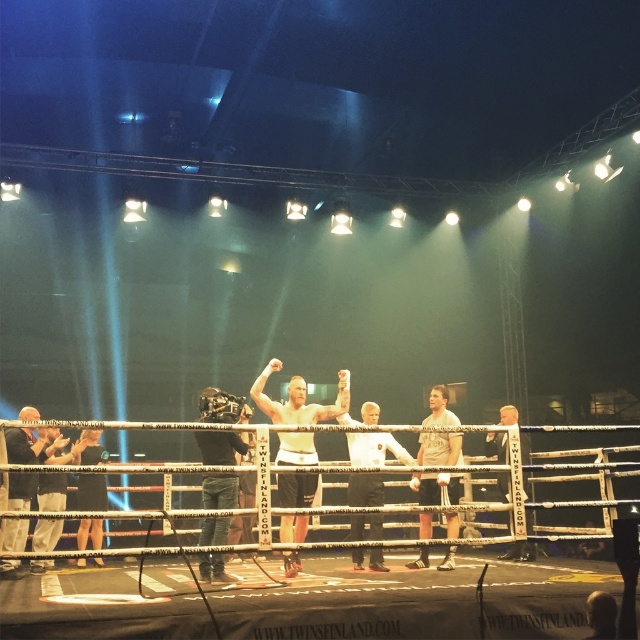
Which is behind, point (224, 566) or point (13, 499)?

Positioned behind is point (13, 499).

Which is more to the right, denim jeans at center or dark gray fabric jacket at left?

Positioned to the right is denim jeans at center.

The height and width of the screenshot is (640, 640). In order to click on denim jeans at center in this screenshot , I will do `click(220, 445)`.

You are a GUI agent. You are given a task and a screenshot of the screen. Output one action in this format:
    pyautogui.click(x=<x>, y=<y>)
    Task: Click on the denim jeans at center
    This screenshot has height=640, width=640.
    Given the screenshot: What is the action you would take?
    pyautogui.click(x=220, y=445)

Does denim jeans at center have a greater width compared to light gray cotton shirt at center?

No, denim jeans at center is not wider than light gray cotton shirt at center.

Measure the distance between denim jeans at center and camera.

They are 5.09 meters apart.

Where is `denim jeans at center`? The image size is (640, 640). denim jeans at center is located at coordinates (220, 445).

Which is in front, point (289, 380) or point (200, 433)?

Positioned in front is point (200, 433).

Is matte white shirt at center positioned in front of denim jeans at center?

No, it is behind denim jeans at center.

I want to click on matte white shirt at center, so click(298, 397).